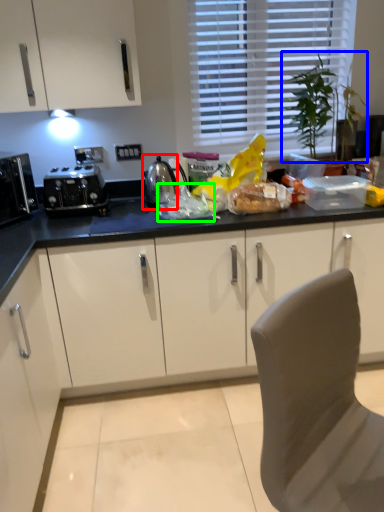
Question: Which object is positioned farthest from appliance (highlighted by a red box)? Select from plant (highlighted by a blue box) and food (highlighted by a green box).

Choices:
 (A) plant
 (B) food

Answer: (A)